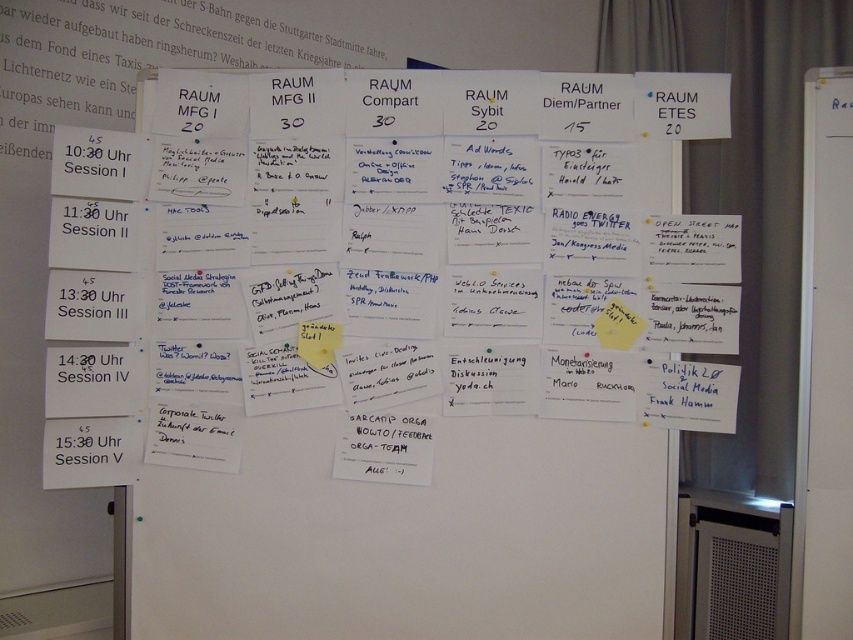
Based on the photo, you are organizing a meeting and need to place a 15cm tall document holder on the white paperboard at right and the yellow sticky note at center. Based on their heights, which surface can accommodate the document holder without it being too tall?

The white paperboard at right has a greater height compared to the yellow sticky note at center, so the document holder can be placed on the white paperboard at right as it is taller and can accommodate the 15cm tall document holder.

You are organizing a meeting and need to place a new note on the whiteboard. The yellow paper at center is already there. Can you place the yellow sticky note at center next to it without overlapping?

The yellow paper at center is wider than the yellow sticky note at center, so there should be enough space to place the yellow sticky note at center next to it without overlapping.

You are standing in front of the whiteboard and see two points marked on it. The first point is at coordinates point (x=619, y=321) and the second is at point (x=316, y=344). Which point appears closer to you?

Point (x=619, y=321) is further to the viewer than point (x=316, y=344), so the second point appears closer.